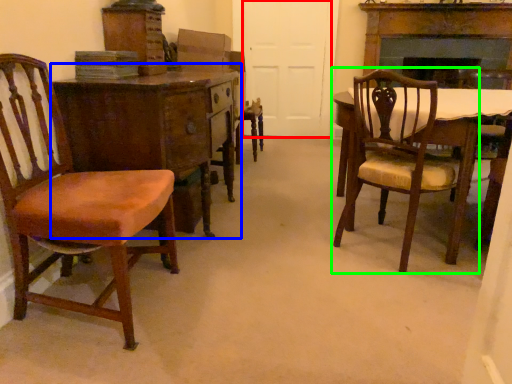
Question: Which object is the farthest from door (highlighted by a red box)? Choose among these: desk (highlighted by a blue box) or chair (highlighted by a green box).

Choices:
 (A) desk
 (B) chair

Answer: (A)